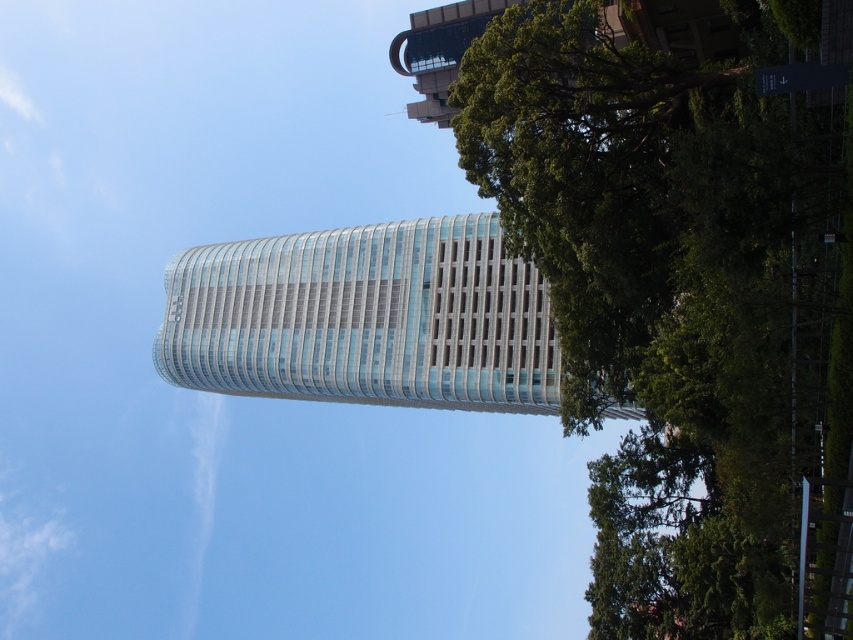
Is green leafy tree at upper right above glassy silver tower at center?

Actually, green leafy tree at upper right is below glassy silver tower at center.

Locate an element on the screen. Image resolution: width=853 pixels, height=640 pixels. green leafy tree at upper right is located at coordinates (682, 298).

Between point (553, 172) and point (251, 312), which one is positioned behind?

The point (251, 312) is more distant.

Locate an element on the screen. This screenshot has width=853, height=640. green leafy tree at upper right is located at coordinates (682, 298).